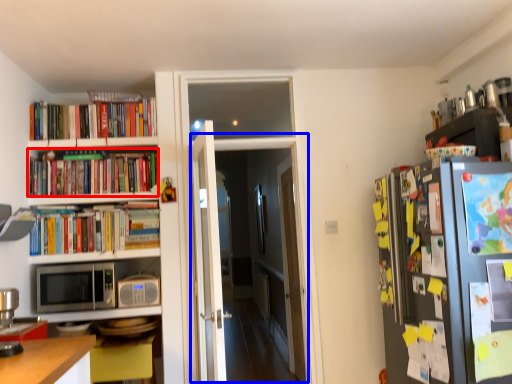
Question: Which object is closer to the camera taking this photo, book (highlighted by a red box) or glass door (highlighted by a blue box)?

Choices:
 (A) book
 (B) glass door

Answer: (B)